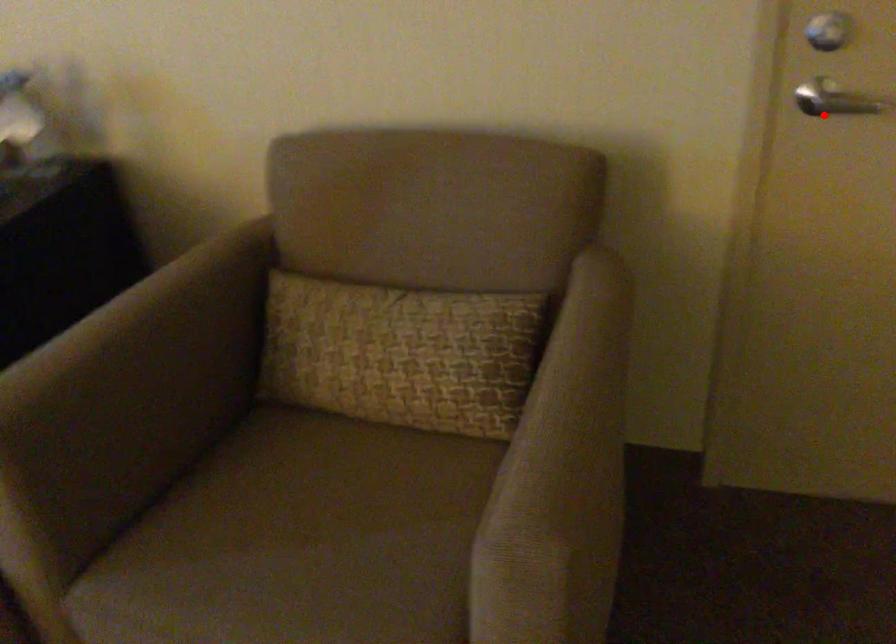
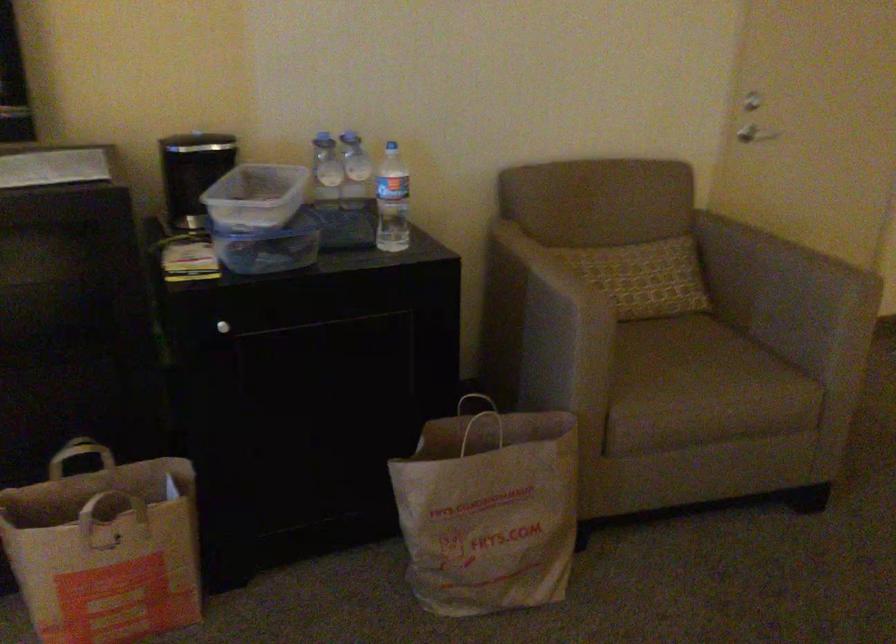
Question: I am providing you with two images of the same scene from different viewpoints. Image1 has a red point marked. In image2, the corresponding 3D location appears at what relative position? Reply with the corresponding letter.

Choices:
 (A) Closer
 (B) Farther

Answer: (B)